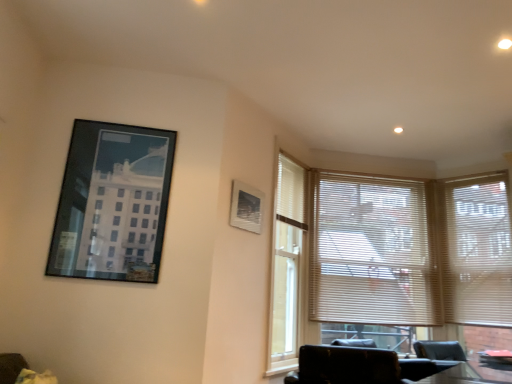
Question: Looking at their shapes, would you say beige/wooden blinds at center, the 2th window blind positioned from the right, is wider or thinner than matte black picture frame at upper left, which appears as the second picture frame when viewed from the right?

Choices:
 (A) thin
 (B) wide

Answer: (B)

Question: Considering the positions of beige/wooden blinds at center, which appears as the 1th window blind when viewed from the left, and matte black picture frame at upper left, which ranks as the 2th picture frame in back-to-front order, in the image, is beige/wooden blinds at center, which appears as the 1th window blind when viewed from the left, bigger or smaller than matte black picture frame at upper left, which ranks as the 2th picture frame in back-to-front order,?

Choices:
 (A) big
 (B) small

Answer: (A)

Question: Which object is the closest to the black leather chair at lower right?

Choices:
 (A) matte white picture frame at upper center, positioned as the second picture frame in front-to-back order
 (B) beige/wooden blinds at center, the 2th window blind positioned from the right
 (C) matte black picture frame at upper left, which appears as the first picture frame when viewed from the front
 (D) white blinds at right, the 1th window blind positioned from the right

Answer: (A)

Question: Estimate the real-world distances between objects in this image. Which object is farther from the white blinds at right, the 1th window blind positioned from the right?

Choices:
 (A) matte black picture frame at upper left, which ranks as the 2th picture frame in back-to-front order
 (B) black leather chair at lower right
 (C) matte white picture frame at upper center, positioned as the second picture frame in front-to-back order
 (D) beige/wooden blinds at center, which appears as the 1th window blind when viewed from the left

Answer: (A)